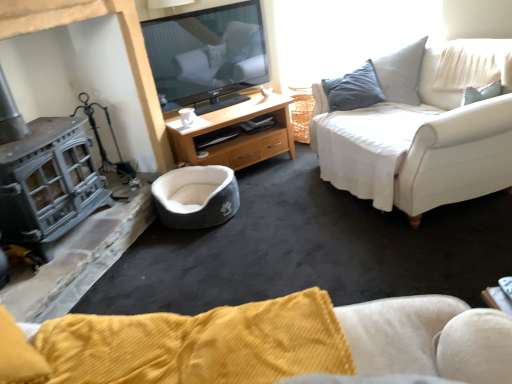
You are a GUI agent. You are given a task and a screenshot of the screen. Output one action in this format:
    pyautogui.click(x=<x>, y=<y>)
    Task: Click on the wooden tv stand at center
    
    Given the screenshot: What is the action you would take?
    pyautogui.click(x=238, y=135)

What do you see at coordinates (238, 135) in the screenshot?
I see `wooden tv stand at center` at bounding box center [238, 135].

Where is `wooden tv stand at center`? wooden tv stand at center is located at coordinates (238, 135).

Locate an element on the screen. This screenshot has width=512, height=384. coffee cup positioned vertically above the gray plush pet bed at center (from a real-world perspective) is located at coordinates (187, 117).

Can you confirm if white glossy coffee cup at center is positioned to the left of gray plush pet bed at center?

Yes.

Is white glossy coffee cup at center turned away from gray plush pet bed at center?

No, gray plush pet bed at center is not at the back of white glossy coffee cup at center.

Considering the relative sizes of white fabric couch at right and white glossy coffee cup at center in the image provided, is white fabric couch at right shorter than white glossy coffee cup at center?

No, white fabric couch at right is not shorter than white glossy coffee cup at center.

Can you confirm if white fabric couch at right is wider than white glossy coffee cup at center?

Yes, white fabric couch at right is wider than white glossy coffee cup at center.

From a real-world perspective, is white fabric couch at right above or below white glossy coffee cup at center?

white fabric couch at right is below white glossy coffee cup at center.

Are white glossy coffee cup at center and wooden tv stand at center making contact?

No, white glossy coffee cup at center is not with wooden tv stand at center.

The width and height of the screenshot is (512, 384). What are the coordinates of `coffee cup lying on the left of wooden tv stand at center` in the screenshot? It's located at (187, 117).

From the image's perspective, is white glossy coffee cup at center located above or below wooden tv stand at center?

From the image's perspective, white glossy coffee cup at center appears above wooden tv stand at center.

Considering the sizes of objects white glossy coffee cup at center and wooden tv stand at center in the image provided, who is shorter, white glossy coffee cup at center or wooden tv stand at center?

white glossy coffee cup at center.

Identify the location of studio couch lying above the white glossy coffee cup at center (from the image's perspective). (416, 146).

Considering the relative sizes of white glossy coffee cup at center and white fabric couch at right in the image provided, is white glossy coffee cup at center smaller than white fabric couch at right?

Yes.

Does white glossy coffee cup at center have a lesser width compared to white fabric couch at right?

Correct, the width of white glossy coffee cup at center is less than that of white fabric couch at right.

Considering the points (180, 111) and (402, 209), which point is behind, point (180, 111) or point (402, 209)?

Point (180, 111)

Is gray plush pet bed at center bigger than white glossy coffee cup at center?

Correct, gray plush pet bed at center is larger in size than white glossy coffee cup at center.

From a real-world perspective, which is physically below, gray plush pet bed at center or white glossy coffee cup at center?

In real-world perspective, gray plush pet bed at center is lower.

Visually, is gray plush pet bed at center positioned to the left or to the right of white glossy coffee cup at center?

Clearly, gray plush pet bed at center is on the right of white glossy coffee cup at center in the image.

How much distance is there between gray plush pet bed at center and white glossy coffee cup at center?

A distance of 51.63 centimeters exists between gray plush pet bed at center and white glossy coffee cup at center.

Between point (179, 168) and point (180, 132), which one is positioned in front?

The point (180, 132) is in front.

In terms of width, does gray plush pet bed at center look wider or thinner when compared to wooden tv stand at center?

In the image, gray plush pet bed at center appears to be more narrow than wooden tv stand at center.

Is gray plush pet bed at center positioned with its back to wooden tv stand at center?

gray plush pet bed at center does not have its back to wooden tv stand at center.

Relative to white fabric couch at right, is wooden tv stand at center in front or behind?

In the image, wooden tv stand at center appears behind white fabric couch at right.

From a real-world perspective, who is located lower, wooden tv stand at center or white fabric couch at right?

wooden tv stand at center, from a real-world perspective.

From the image's perspective, which is above, wooden tv stand at center or white fabric couch at right?

From the image's view, white fabric couch at right is above.

You are a GUI agent. You are given a task and a screenshot of the screen. Output one action in this format:
    pyautogui.click(x=<x>, y=<y>)
    Task: Click on the bean bag chair in front of the white glossy coffee cup at center
    The width and height of the screenshot is (512, 384).
    Given the screenshot: What is the action you would take?
    pyautogui.click(x=196, y=196)

Identify the location of studio couch that is on the right side of white glossy coffee cup at center. The height and width of the screenshot is (384, 512). (416, 146).

Based on their spatial positions, is gray plush pet bed at center or wooden tv stand at center closer to white fabric couch at right?

The object closer to white fabric couch at right is wooden tv stand at center.

From the image, which object appears to be nearer to white fabric couch at right, wooden tv stand at center or gray plush pet bed at center?

wooden tv stand at center.

Based on their spatial positions, is gray plush pet bed at center or white glossy coffee cup at center closer to wooden tv stand at center?

The object closer to wooden tv stand at center is gray plush pet bed at center.

Which object lies further to the anchor point gray plush pet bed at center, white glossy coffee cup at center or wooden tv stand at center?

white glossy coffee cup at center is further to gray plush pet bed at center.

Looking at this image, looking at the image, which one is located further to white fabric couch at right, wooden tv stand at center or white glossy coffee cup at center?

white glossy coffee cup at center is further to white fabric couch at right.

Looking at the image, which one is located further to wooden tv stand at center, gray plush pet bed at center or white fabric couch at right?

white fabric couch at right lies further to wooden tv stand at center than the other object.

Estimate the real-world distances between objects in this image. Which object is closer to white fabric couch at right, gray plush pet bed at center or white glossy coffee cup at center?

gray plush pet bed at center lies closer to white fabric couch at right than the other object.

Which object lies further to the anchor point white glossy coffee cup at center, gray plush pet bed at center or white fabric couch at right?

Among the two, white fabric couch at right is located further to white glossy coffee cup at center.

You are a GUI agent. You are given a task and a screenshot of the screen. Output one action in this format:
    pyautogui.click(x=<x>, y=<y>)
    Task: Click on the bean bag chair located between white glossy coffee cup at center and white fabric couch at right in the left-right direction
    The image size is (512, 384).
    Given the screenshot: What is the action you would take?
    pyautogui.click(x=196, y=196)

Locate an element on the screen. Image resolution: width=512 pixels, height=384 pixels. desk between white glossy coffee cup at center and gray plush pet bed at center in the vertical direction is located at coordinates (238, 135).

Where is `desk between gray plush pet bed at center and white fabric couch at right in the horizontal direction`? The image size is (512, 384). desk between gray plush pet bed at center and white fabric couch at right in the horizontal direction is located at coordinates (238, 135).

You are a GUI agent. You are given a task and a screenshot of the screen. Output one action in this format:
    pyautogui.click(x=<x>, y=<y>)
    Task: Click on the desk between white glossy coffee cup at center and white fabric couch at right
    Image resolution: width=512 pixels, height=384 pixels.
    Given the screenshot: What is the action you would take?
    pyautogui.click(x=238, y=135)